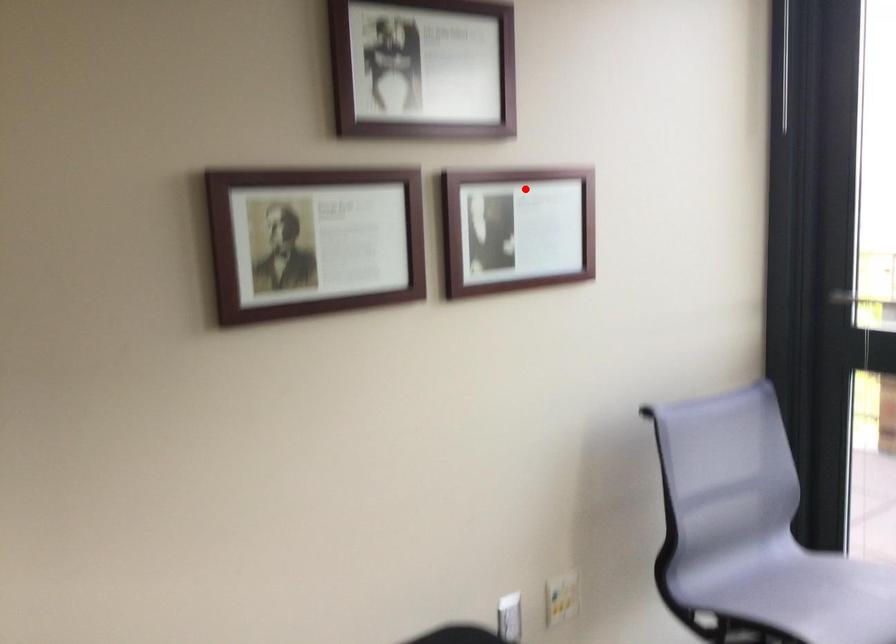
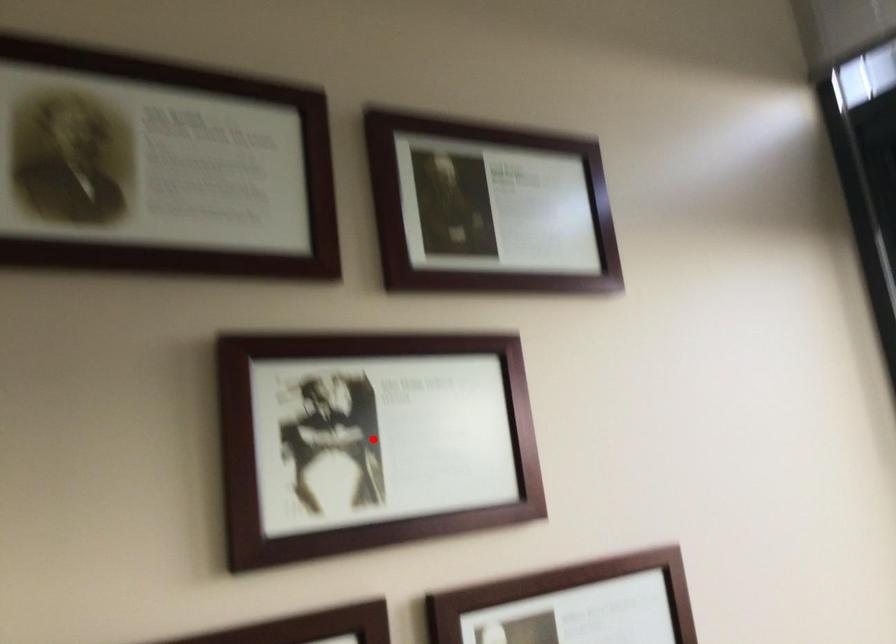
I am providing you with two images of the same scene from different viewpoints. A red point is marked on the first image and another point is marked on the second image. Are the points marked in image1 and image2 representing the same 3D position?

No